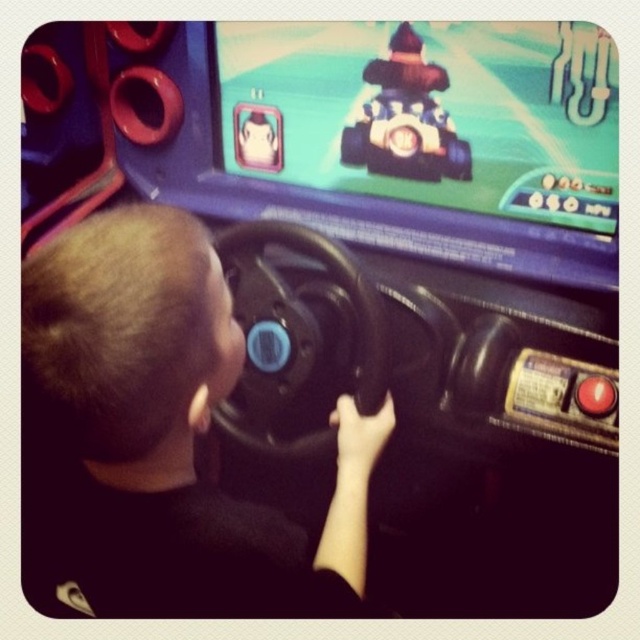
You are a parent trying to decide which steering wheel to let your child use. Both the black matte steering wheel at center and the black plastic steering wheel at center are available. Which one has a wider grip for smaller hands?

The black matte steering wheel at center has a larger width than the black plastic steering wheel at center, making it a better fit for smaller hands.

You are a parent trying to decide whether to let your child play the arcade machine. The black plastic steering wheel at center and the shiny blue plastic toy car at center are both part of the setup. Which object is taller?

The black plastic steering wheel at center is taller than the shiny blue plastic toy car at center.